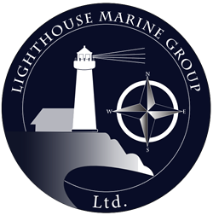
Locate an element on the screen. window is located at coordinates (81, 56), (86, 55).